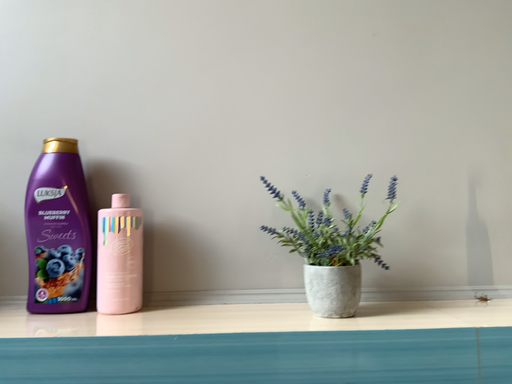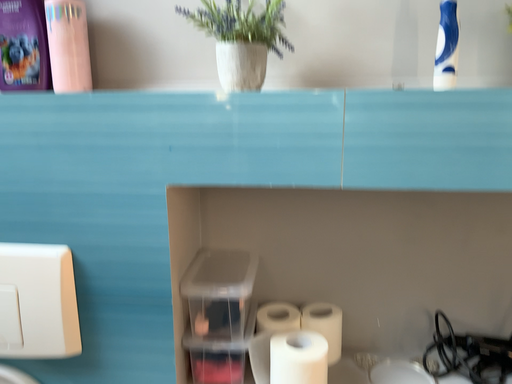
Question: Which way did the camera rotate in the video?

Choices:
 (A) rotated left
 (B) rotated right

Answer: (A)